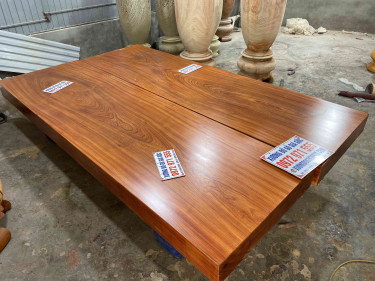
What are the coordinates of `floor` in the screenshot? It's located at (323, 48).